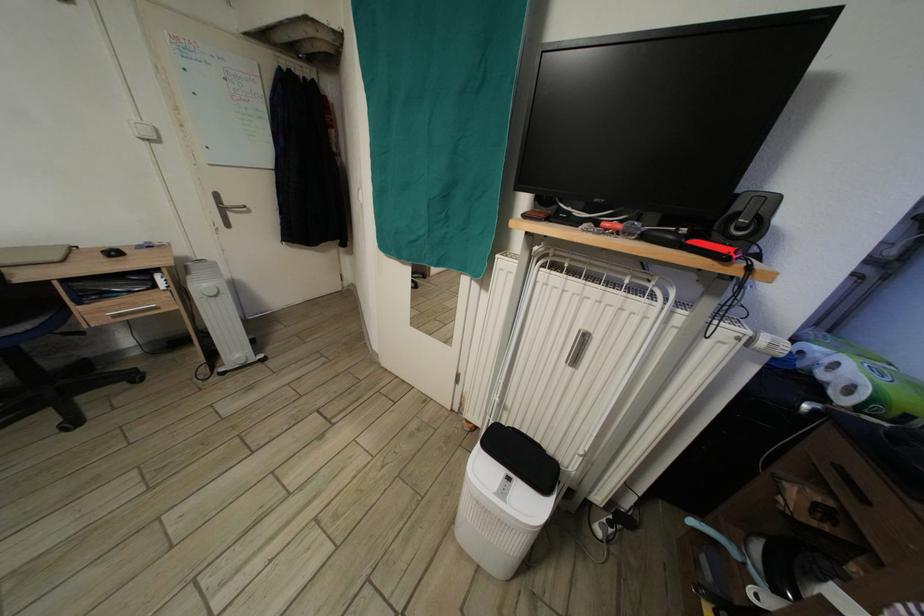
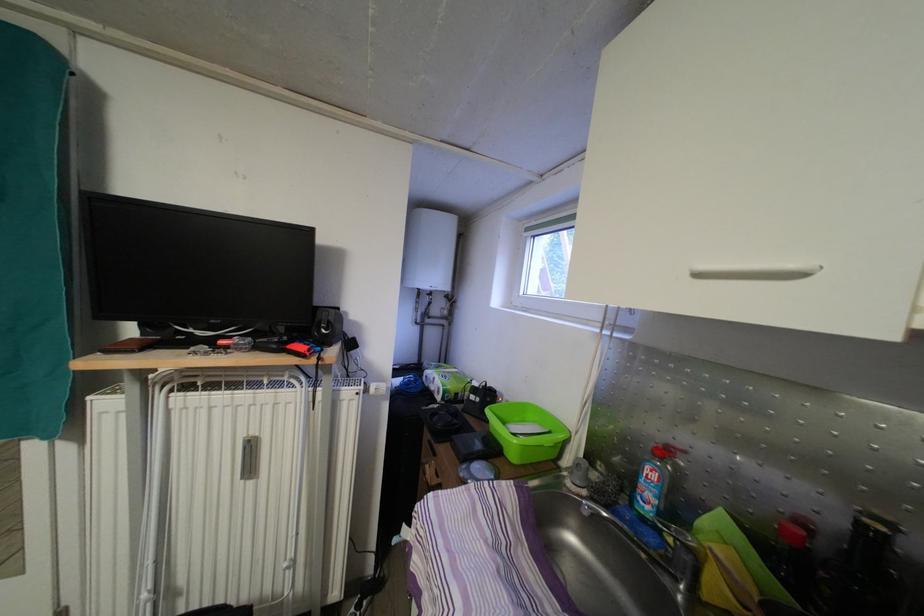
Locate, in the second image, the point that corresponds to point (757, 339) in the first image.

(369, 394)